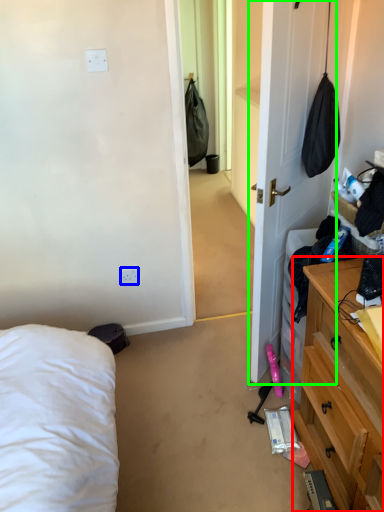
Question: Estimate the real-world distances between objects in this image. Which object is closer to cabinetry (highlighted by a red box), electric outlet (highlighted by a blue box) or door (highlighted by a green box)?

Choices:
 (A) electric outlet
 (B) door

Answer: (B)